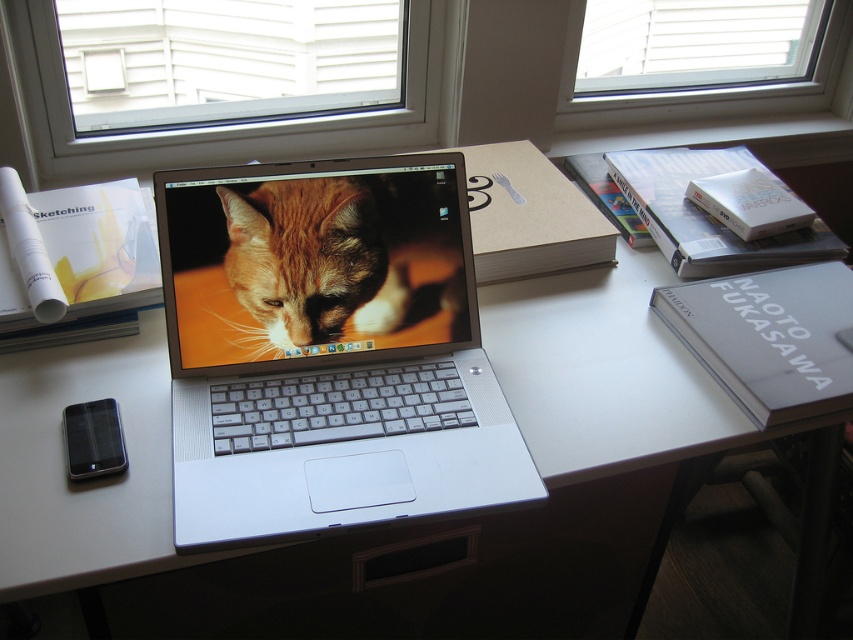
Question: In this image, where is orange fur cat at center located relative to clear glass window at upper center?

Choices:
 (A) below
 (B) above

Answer: (A)

Question: Among these points, which one is farthest from the camera?

Choices:
 (A) (271, 282)
 (B) (575, 49)
 (C) (227, 1)
 (D) (483, 451)

Answer: (B)

Question: Among these objects, which one is farthest from the camera?

Choices:
 (A) silver metallic laptop at center
 (B) white plastic window at upper center
 (C) clear glass window at upper center

Answer: (C)

Question: Can you confirm if silver metallic laptop at center is smaller than orange fur cat at center?

Choices:
 (A) yes
 (B) no

Answer: (B)

Question: Which of the following is the closest to the observer?

Choices:
 (A) (263, 93)
 (B) (315, 241)
 (C) (354, 176)

Answer: (B)

Question: Is silver metallic laptop at center in front of white plastic window at upper center?

Choices:
 (A) no
 (B) yes

Answer: (B)